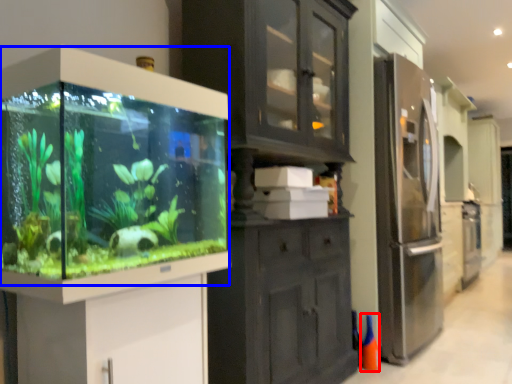
Question: Which object is closer to the camera taking this photo, cone (highlighted by a red box) or glass box (highlighted by a blue box)?

Choices:
 (A) cone
 (B) glass box

Answer: (B)